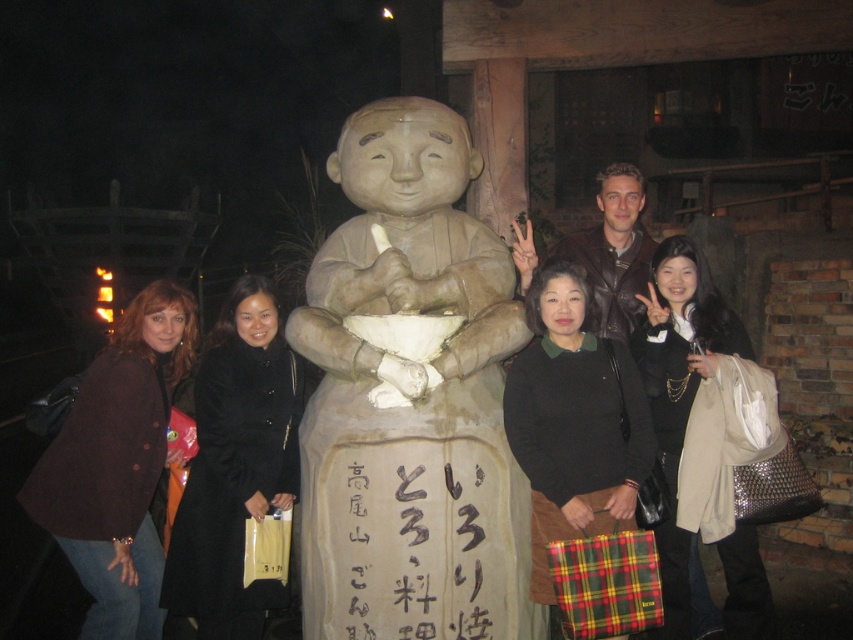
Is matte clay statue at center smaller than brown woolen coat at left?

Incorrect, matte clay statue at center is not smaller in size than brown woolen coat at left.

Which is more to the left, matte clay statue at center or brown woolen coat at left?

Positioned to the left is brown woolen coat at left.

Who is more distant from viewer, (497, 452) or (131, 397)?

Point (131, 397)

I want to click on matte clay statue at center, so click(410, 397).

Can you confirm if black calligraphy sign at center is thinner than matte black coat at center?

In fact, black calligraphy sign at center might be wider than matte black coat at center.

Between black calligraphy sign at center and matte black coat at center, which one is positioned higher?

matte black coat at center is higher up.

Who is more forward, (476,541) or (677,452)?

Point (476,541) is more forward.

Image resolution: width=853 pixels, height=640 pixels. Find the location of `black calligraphy sign at center`. black calligraphy sign at center is located at coordinates (416, 541).

Between brown woolen coat at left and matte black coat at center, which one has less height?

Standing shorter between the two is brown woolen coat at left.

Does brown woolen coat at left have a lesser height compared to matte black coat at center?

Indeed, brown woolen coat at left has a lesser height compared to matte black coat at center.

Measure the distance between point (97, 586) and camera.

4.10 meters

Find the location of a particular element. The image size is (853, 640). brown woolen coat at left is located at coordinates (117, 465).